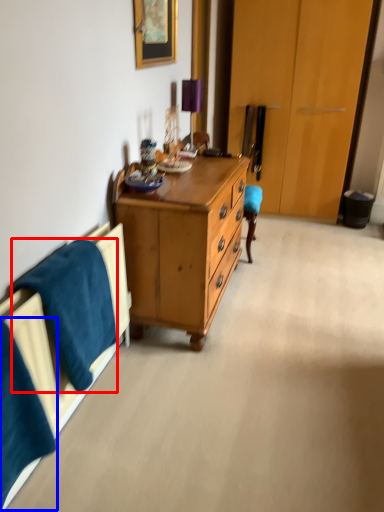
Question: Which point is closer to the camera, blanket (highlighted by a red box) or blanket (highlighted by a blue box)?

Choices:
 (A) blanket
 (B) blanket

Answer: (B)